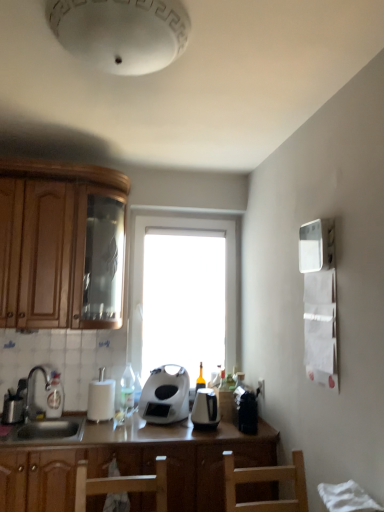
Where is `free space in front of translucent glass bottle at sink left, marked as the 2th bottle in a right-to-left arrangement`? The height and width of the screenshot is (512, 384). free space in front of translucent glass bottle at sink left, marked as the 2th bottle in a right-to-left arrangement is located at coordinates (45, 424).